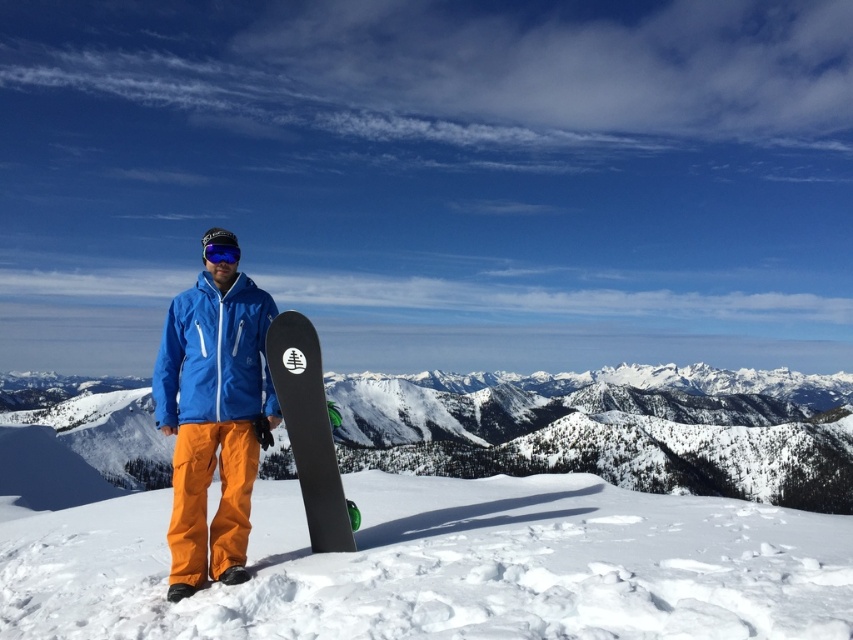
Who is shorter, matte blue jacket at center or blue reflective lens goggles at center?

blue reflective lens goggles at center

Which is behind, point (216, 336) or point (213, 244)?

Positioned behind is point (213, 244).

Which is in front, point (262, 305) or point (219, 250)?

Point (219, 250)

At what (x,y) coordinates should I click in order to perform the action: click on matte blue jacket at center. Please return your answer as a coordinate pair (x, y). Looking at the image, I should click on (213, 355).

Which is more to the right, matte blue jacket at center or black matte snowboard at center?

Positioned to the right is black matte snowboard at center.

Measure the distance between matte blue jacket at center and black matte snowboard at center.

6.09 meters

Identify the location of matte blue jacket at center. (213, 355).

Between snowy mountain at center and matte blue jacket at center, which one appears on the left side from the viewer's perspective?

From the viewer's perspective, matte blue jacket at center appears more on the left side.

Between point (582, 394) and point (236, 369), which one is positioned behind?

The point (582, 394) is more distant.

Between point (115, 461) and point (248, 314), which one is positioned in front?

Point (248, 314) is more forward.

Where is `snowy mountain at center`? The height and width of the screenshot is (640, 853). snowy mountain at center is located at coordinates (612, 428).